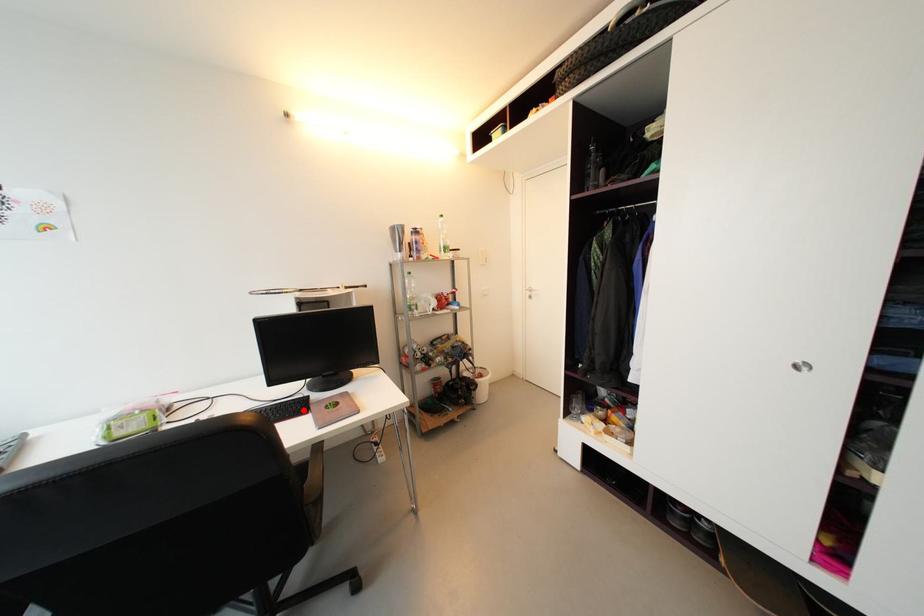
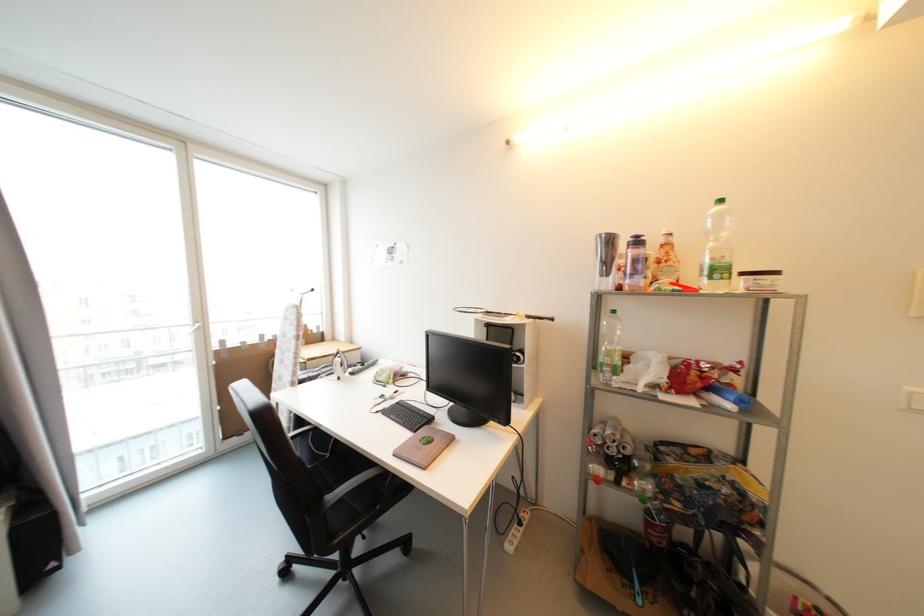
The point at the highlighted location is marked in the first image. Where is the corresponding point in the second image?

(396, 426)